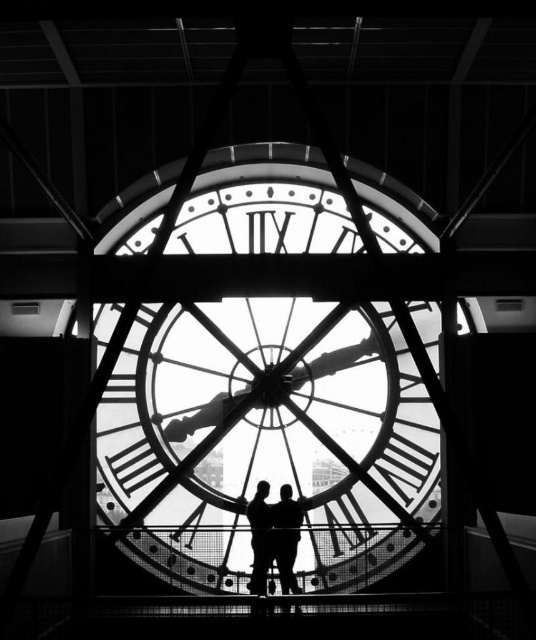
Does black matte couple at center appear under silhouette figure at center?

Correct, black matte couple at center is located below silhouette figure at center.

Is point (257, 486) farther from viewer compared to point (258, 593)?

Yes, point (257, 486) is behind point (258, 593).

Between point (264, 531) and point (249, 506), which one is positioned in front?

Point (264, 531) is more forward.

You are a GUI agent. You are given a task and a screenshot of the screen. Output one action in this format:
    pyautogui.click(x=<x>, y=<y>)
    Task: Click on the black matte couple at center
    The width and height of the screenshot is (536, 640).
    Given the screenshot: What is the action you would take?
    pyautogui.click(x=273, y=538)

Can you confirm if metallic clock at center is smaller than silhouette figure at center?

No.

From the picture: Who is higher up, metallic clock at center or silhouette figure at center?

metallic clock at center is above.

I want to click on metallic clock at center, so click(x=272, y=499).

Does metallic clock at center have a greater height compared to black matte couple at center?

Yes, metallic clock at center is taller than black matte couple at center.

Between metallic clock at center and black matte couple at center, which one is positioned higher?

metallic clock at center is above.

At what (x,y) coordinates should I click in order to perform the action: click on metallic clock at center. Please return your answer as a coordinate pair (x, y). The width and height of the screenshot is (536, 640). Looking at the image, I should click on (272, 499).

What are the coordinates of `metallic clock at center` in the screenshot? It's located at (272, 499).